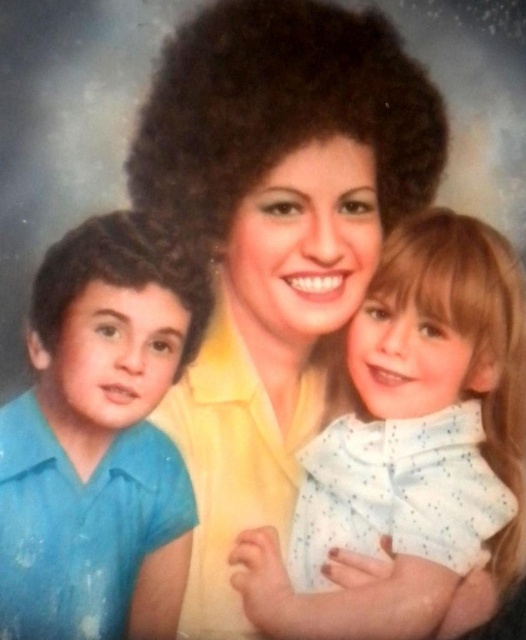
You are a tailor who needs to determine the correct size for the yellow matte shirt at center and the blue cotton shirt at left. Based on their heights in the image, which shirt should you choose a larger size for?

The yellow matte shirt at center is taller than the blue cotton shirt at left, so the tailor should choose a larger size for the yellow matte shirt at center.

You are a photographer setting up for a family photo. You need to place a microphone stand to the left of the blue cotton shirt at left but to the right of the white dotted shirt at center. Is this possible?

The white dotted shirt at center is to the right of the blue cotton shirt at left, so placing the microphone stand to the left of the blue cotton shirt at left and to the right of the white dotted shirt at center is not possible because the blue cotton shirt at left is already to the left of the white dotted shirt at center.